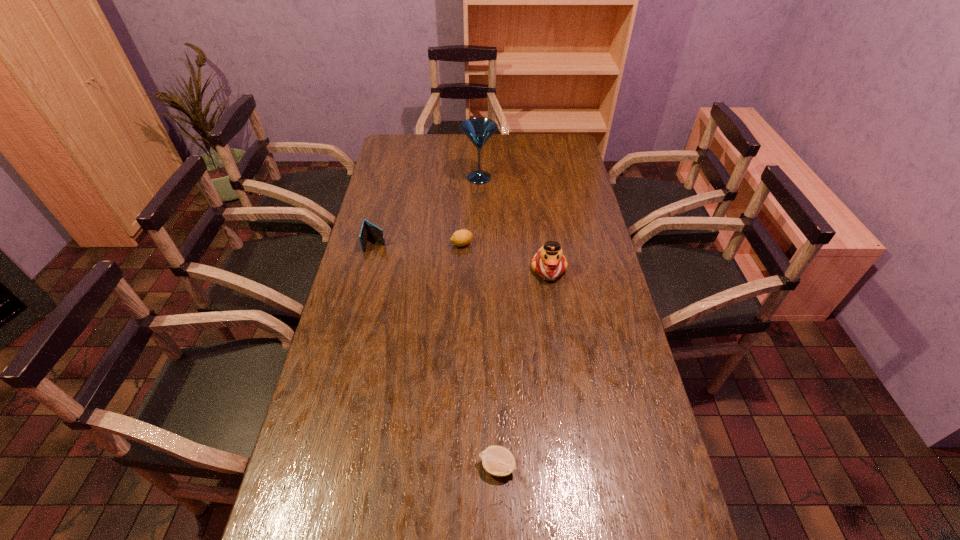
The width and height of the screenshot is (960, 540). In order to click on free space at the far left corner in this screenshot , I will do `click(414, 147)`.

Find the location of a particular element. The image size is (960, 540). vacant region at the far right corner of the desktop is located at coordinates (550, 154).

Find the location of `vacant region between the rightmost object and the farthest object`. vacant region between the rightmost object and the farthest object is located at coordinates (514, 224).

Identify the location of vacant space that is in between the wallet and the left lemon. (419, 244).

This screenshot has height=540, width=960. In order to click on free space between the rightmost object and the nearest object in this screenshot , I will do `click(523, 368)`.

Where is `free point between the farthest object and the rightmost object`? This screenshot has height=540, width=960. free point between the farthest object and the rightmost object is located at coordinates (514, 224).

This screenshot has height=540, width=960. I want to click on free point between the wallet and the martini, so click(427, 211).

The image size is (960, 540). I want to click on empty space that is in between the martini and the leftmost object, so click(x=427, y=211).

I want to click on vacant space that's between the farthest object and the farther lemon, so click(x=470, y=211).

Identify the location of free spot between the farthest object and the nearest object. (489, 322).